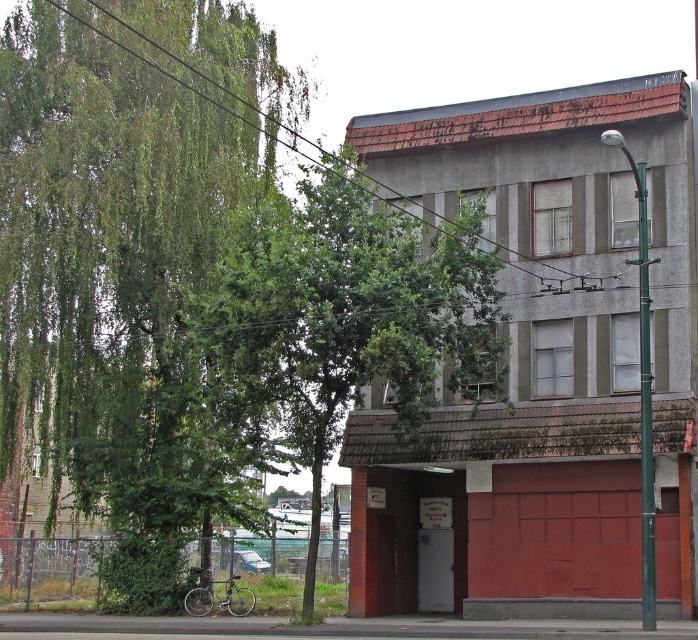
In the scene shown: You are standing in front of the building and want to take a photo of the red garage door. To avoid the green leafy tree at left from blocking the view, where should you position yourself relative to the tree?

To avoid the green leafy tree at left blocking the view of the red garage door, you should position yourself to the right of the green leafy tree at left since the tree is located at the left side of the scene.